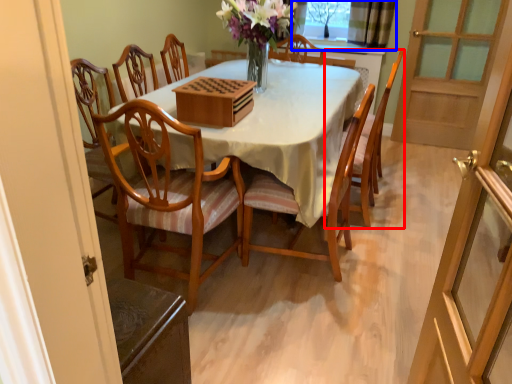
Question: Which object is closer to the camera taking this photo, chair (highlighted by a red box) or window (highlighted by a blue box)?

Choices:
 (A) chair
 (B) window

Answer: (A)